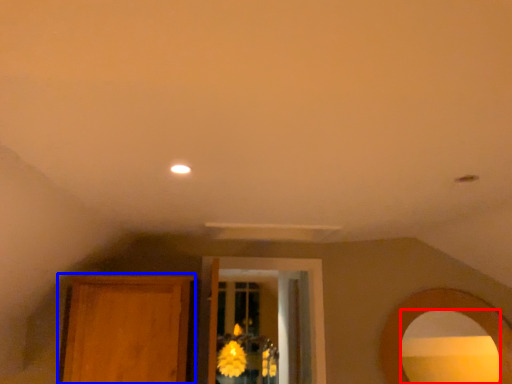
Question: Among these objects, which one is nearest to the camera, mirror (highlighted by a red box) or armoire (highlighted by a blue box)?

Choices:
 (A) mirror
 (B) armoire

Answer: (A)